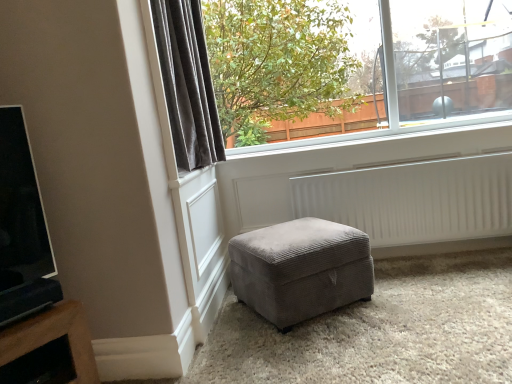
Question: Is velvet gray curtain at upper left further to camera compared to clear glass window at upper center?

Choices:
 (A) yes
 (B) no

Answer: (B)

Question: Is velvet gray curtain at upper left smaller than clear glass window at upper center?

Choices:
 (A) yes
 (B) no

Answer: (A)

Question: Does velvet gray curtain at upper left have a lesser width compared to clear glass window at upper center?

Choices:
 (A) no
 (B) yes

Answer: (A)

Question: From a real-world perspective, is velvet gray curtain at upper left on top of clear glass window at upper center?

Choices:
 (A) yes
 (B) no

Answer: (B)

Question: Considering the relative positions of velvet gray curtain at upper left and clear glass window at upper center in the image provided, is velvet gray curtain at upper left to the right of clear glass window at upper center from the viewer's perspective?

Choices:
 (A) no
 (B) yes

Answer: (A)

Question: From their relative heights in the image, would you say velvet gray curtain at upper left is taller or shorter than velvet grey ottoman at center?

Choices:
 (A) short
 (B) tall

Answer: (B)

Question: From a real-world perspective, is velvet gray curtain at upper left above or below velvet grey ottoman at center?

Choices:
 (A) above
 (B) below

Answer: (A)

Question: Which is correct: velvet gray curtain at upper left is inside velvet grey ottoman at center, or outside of it?

Choices:
 (A) outside
 (B) inside

Answer: (A)

Question: Considering the positions of point (199, 155) and point (360, 256), is point (199, 155) closer or farther from the camera than point (360, 256)?

Choices:
 (A) farther
 (B) closer

Answer: (A)

Question: Which is correct: velvet gray curtain at upper left is inside white ribbed radiator at lower center, or outside of it?

Choices:
 (A) inside
 (B) outside

Answer: (B)

Question: Based on their sizes in the image, would you say velvet gray curtain at upper left is bigger or smaller than white ribbed radiator at lower center?

Choices:
 (A) small
 (B) big

Answer: (B)

Question: In terms of width, does velvet gray curtain at upper left look wider or thinner when compared to white ribbed radiator at lower center?

Choices:
 (A) thin
 (B) wide

Answer: (B)

Question: Considering the relative positions of velvet gray curtain at upper left and white ribbed radiator at lower center in the image provided, is velvet gray curtain at upper left to the left or to the right of white ribbed radiator at lower center?

Choices:
 (A) left
 (B) right

Answer: (A)

Question: From the image's perspective, is clear glass window at upper center above or below velvet gray curtain at upper left?

Choices:
 (A) below
 (B) above

Answer: (B)

Question: Is point (501, 76) positioned closer to the camera than point (158, 16)?

Choices:
 (A) closer
 (B) farther

Answer: (B)